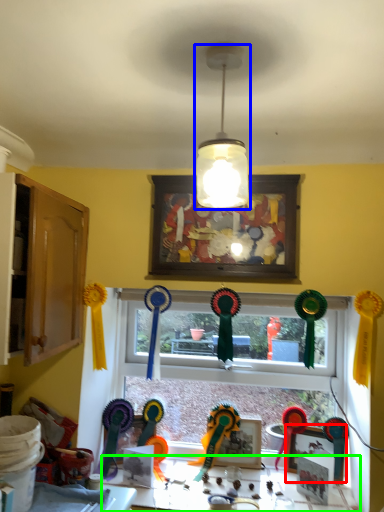
Question: Which object is positioned closest to picture frame (highlighted by a red box)? Select from lamp (highlighted by a blue box) and table (highlighted by a green box).

Choices:
 (A) lamp
 (B) table

Answer: (B)